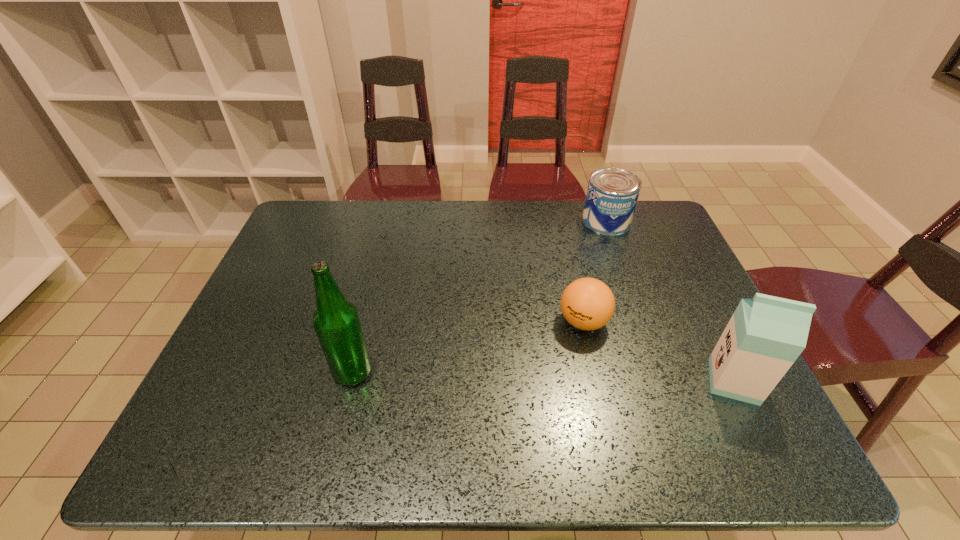
You are a GUI agent. You are given a task and a screenshot of the screen. Output one action in this format:
    pyautogui.click(x=<x>, y=<y>)
    Task: Click on the vacant space that's between the leftmost object and the third tallest object
    Image resolution: width=960 pixels, height=540 pixels.
    Given the screenshot: What is the action you would take?
    pyautogui.click(x=480, y=296)

Where is `free space between the third object from right to left and the third tallest object`? This screenshot has height=540, width=960. free space between the third object from right to left and the third tallest object is located at coordinates (595, 271).

You are a GUI agent. You are given a task and a screenshot of the screen. Output one action in this format:
    pyautogui.click(x=<x>, y=<y>)
    Task: Click on the vacant area between the third nearest object and the can
    The width and height of the screenshot is (960, 540).
    Given the screenshot: What is the action you would take?
    pyautogui.click(x=595, y=271)

What are the coordinates of `vacant space in between the beer bottle and the rightmost object` in the screenshot? It's located at [543, 376].

The height and width of the screenshot is (540, 960). Identify the location of free space between the shortest object and the second tallest object. (659, 351).

Find the location of `unoccupied area between the second tallest object and the second farthest object`. unoccupied area between the second tallest object and the second farthest object is located at coordinates (659, 351).

At what (x,y) coordinates should I click in order to perform the action: click on empty space between the ping-pong ball and the beer bottle. Please return your answer as a coordinate pair (x, y). The width and height of the screenshot is (960, 540). Looking at the image, I should click on (468, 347).

Identify the location of empty space that is in between the third object from right to left and the third tallest object. The image size is (960, 540). (595, 271).

Locate an element on the screen. This screenshot has width=960, height=540. empty space between the rightmost object and the ping-pong ball is located at coordinates (659, 351).

You are a GUI agent. You are given a task and a screenshot of the screen. Output one action in this format:
    pyautogui.click(x=<x>, y=<y>)
    Task: Click on the free space between the second farthest object and the rightmost object
    The width and height of the screenshot is (960, 540).
    Given the screenshot: What is the action you would take?
    pyautogui.click(x=659, y=351)